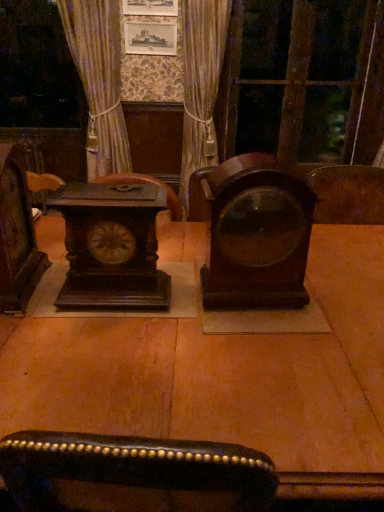
The height and width of the screenshot is (512, 384). I want to click on free space in front of dark brown wood clock at left, the 2th alarm clock in the right-to-left sequence, so click(107, 339).